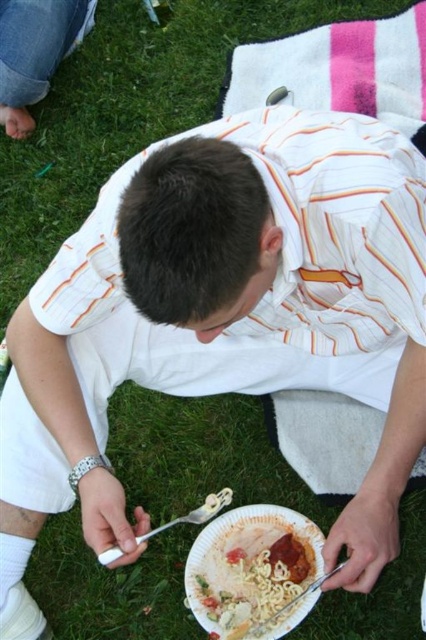
Between white paper plate at lower center and jeans at upper left, which one has less height?

With less height is white paper plate at lower center.

Find the location of a particular element. The height and width of the screenshot is (640, 426). white paper plate at lower center is located at coordinates (250, 570).

Between white paper plate at lower center and silver metallic fork at lower center, which one is positioned higher?

Positioned higher is silver metallic fork at lower center.

Who is more forward, [317,548] or [155,529]?

Positioned in front is point [155,529].

Where is `white paper plate at lower center`? This screenshot has height=640, width=426. white paper plate at lower center is located at coordinates (250, 570).

Between jeans at upper left and silver metallic fork at lower center, which one has less height?

silver metallic fork at lower center is shorter.

Consider the image. Can you confirm if jeans at upper left is smaller than silver metallic fork at lower center?

No, jeans at upper left is not smaller than silver metallic fork at lower center.

Is point (63, 22) closer to camera compared to point (204, 506)?

No.

At what (x,y) coordinates should I click in order to perform the action: click on jeans at upper left. Please return your answer as a coordinate pair (x, y). Image resolution: width=426 pixels, height=640 pixels. Looking at the image, I should click on (34, 51).